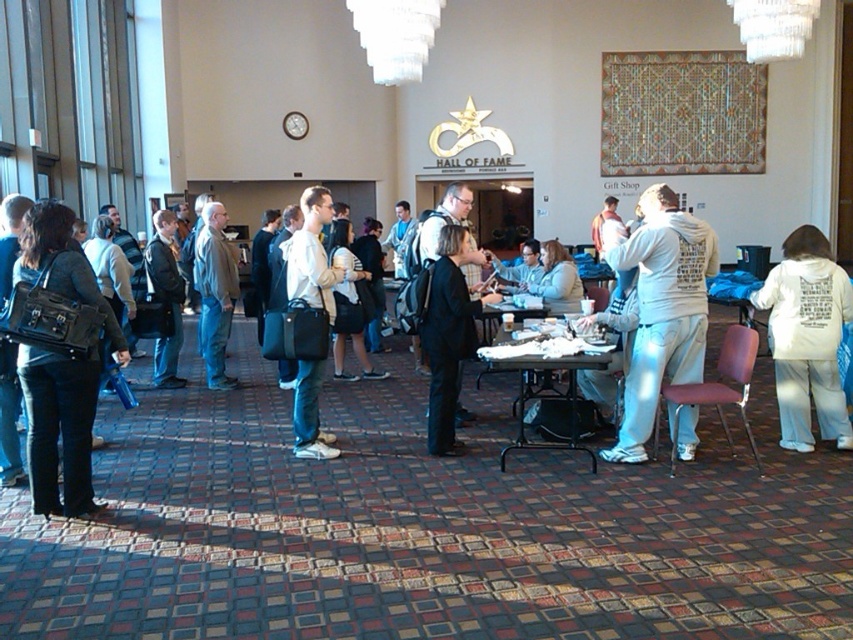
You are organizing a charity event and need to pack items into a donation box. The donation box can only fit items smaller than the white cotton hoodie at center. Can the matte black bag at left be placed inside the donation box?

The white cotton hoodie at center is bigger than the matte black bag at left. Since the donation box can only fit items smaller than the white cotton hoodie at center, the matte black bag at left can be placed inside the donation box because it is smaller.